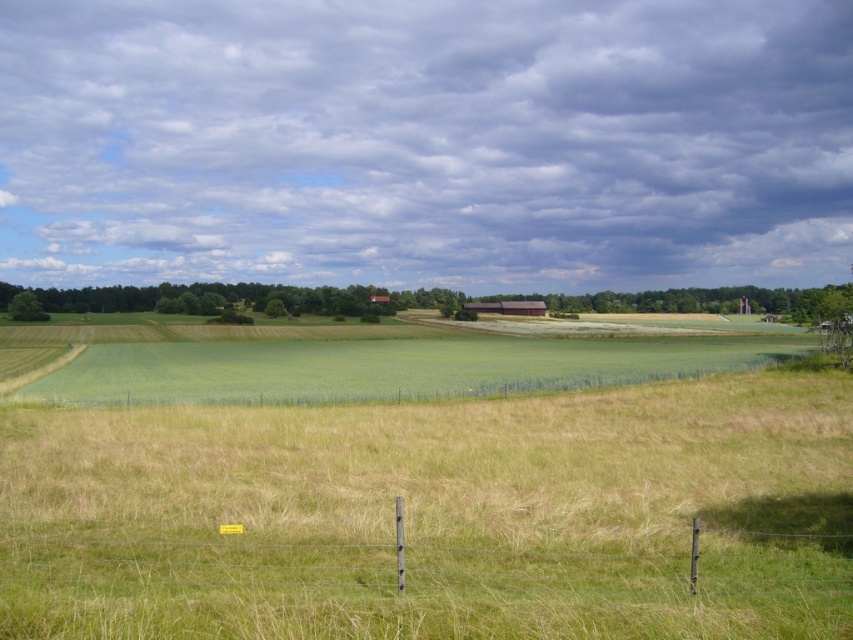
Between green grassy wheat field at center and green grassy field at center, which one is positioned higher?

green grassy field at center

In the scene shown: Does green grassy wheat field at center come in front of green grassy field at center?

Yes, green grassy wheat field at center is closer to the viewer.

At what (x,y) coordinates should I click in order to perform the action: click on green grassy wheat field at center. Please return your answer as a coordinate pair (x, y). The width and height of the screenshot is (853, 640). Looking at the image, I should click on (436, 515).

Identify the location of green grassy wheat field at center. (436, 515).

Does green grassy fence at lower center appear on the left side of green grassy field at center?

No, green grassy fence at lower center is not to the left of green grassy field at center.

Is green grassy fence at lower center above green grassy field at center?

Yes.

Who is more distant from viewer, (263, 573) or (143, 348)?

Point (143, 348)

The height and width of the screenshot is (640, 853). I want to click on green grassy fence at lower center, so click(436, 577).

Is green grassy wheat field at center bigger than green grassy fence at lower center?

Yes, green grassy wheat field at center is bigger than green grassy fence at lower center.

Does green grassy wheat field at center have a greater width compared to green grassy fence at lower center?

Indeed, green grassy wheat field at center has a greater width compared to green grassy fence at lower center.

Image resolution: width=853 pixels, height=640 pixels. I want to click on green grassy wheat field at center, so click(x=436, y=515).